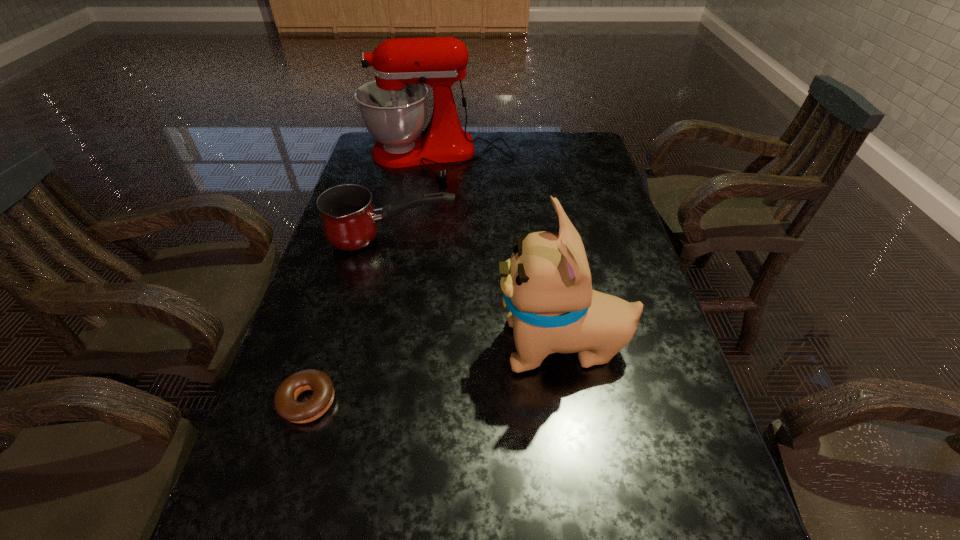
The width and height of the screenshot is (960, 540). What are the coordinates of `vacant region located 0.190m on the front of the doughnut` in the screenshot? It's located at tap(266, 539).

The height and width of the screenshot is (540, 960). What are the coordinates of `object located at the far edge` in the screenshot? It's located at (393, 108).

Locate an element on the screen. The width and height of the screenshot is (960, 540). mixer positioned at the left edge is located at coordinates (393, 108).

Image resolution: width=960 pixels, height=540 pixels. Identify the location of saucepan positioned at the left edge. (350, 223).

Identify the location of doughnut located in the left edge section of the desktop. (286, 406).

Locate an element on the screen. The image size is (960, 540). object present at the right edge is located at coordinates (547, 287).

You are a GUI agent. You are given a task and a screenshot of the screen. Output one action in this format:
    pyautogui.click(x=<x>, y=<y>)
    Task: Click on the object situated at the far left corner
    The image size is (960, 540).
    Given the screenshot: What is the action you would take?
    pyautogui.click(x=393, y=108)

This screenshot has height=540, width=960. In order to click on blank space at the far edge of the desktop in this screenshot , I will do `click(485, 164)`.

Locate an element on the screen. The image size is (960, 540). vacant space at the left edge of the desktop is located at coordinates (380, 265).

In the image, there is a desktop. What are the coordinates of `vacant space at the right edge` in the screenshot? It's located at (564, 179).